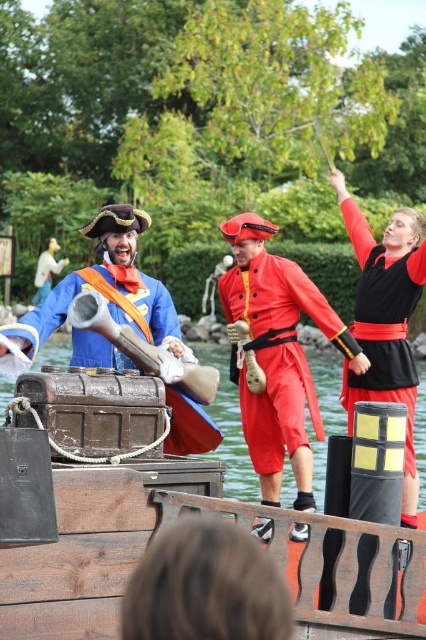
How much distance is there between shiny red uniform at center and wooden planks boat at center?

They are 14.82 meters apart.

Find the location of a particular element. This screenshot has height=640, width=426. shiny red uniform at center is located at coordinates (276, 355).

Is point (230, 227) positioned after point (226, 442)?

No, it is not.

At what (x,y) coordinates should I click in order to perform the action: click on shiny red uniform at center. Please return your answer as a coordinate pair (x, y). Looking at the image, I should click on (276, 355).

Between wooden treasure chest at center and matte blue fabric at center, which one appears on the left side from the viewer's perspective?

From the viewer's perspective, matte blue fabric at center appears more on the left side.

Who is taller, wooden treasure chest at center or matte blue fabric at center?

wooden treasure chest at center is taller.

You are a GUI agent. You are given a task and a screenshot of the screen. Output one action in this format:
    pyautogui.click(x=<x>, y=<y>)
    Task: Click on the wooden treasure chest at center
    The image size is (426, 640).
    Given the screenshot: What is the action you would take?
    pyautogui.click(x=106, y=301)

Image resolution: width=426 pixels, height=640 pixels. Identify the location of wooden treasure chest at center. (106, 301).

Who is lower down, brown leather hair at lower center or wooden planks boat at center?

brown leather hair at lower center is lower down.

From the picture: How distant is brown leather hair at lower center from wooden planks boat at center?

brown leather hair at lower center and wooden planks boat at center are 22.15 meters apart from each other.

Is point (238, 625) positioned in front of point (310, 365)?

Yes, it is in front of point (310, 365).

Where is `brown leather hair at lower center`? The height and width of the screenshot is (640, 426). brown leather hair at lower center is located at coordinates (206, 586).